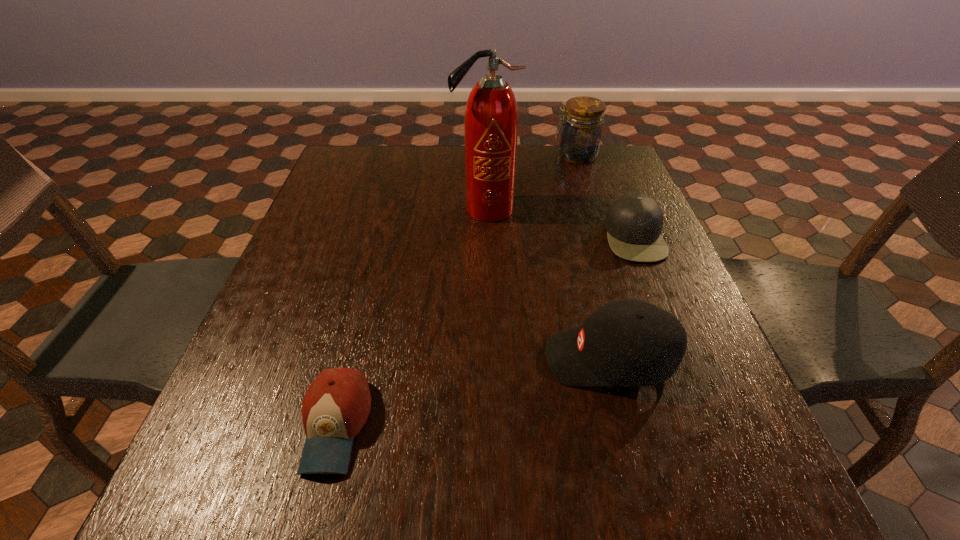
You are a GUI agent. You are given a task and a screenshot of the screen. Output one action in this format:
    pyautogui.click(x=<x>, y=<y>)
    Task: Click on the free region at the right edge
    
    Given the screenshot: What is the action you would take?
    pyautogui.click(x=683, y=315)

This screenshot has height=540, width=960. In order to click on vacant space at the far left corner of the desktop in this screenshot , I will do `click(360, 158)`.

This screenshot has height=540, width=960. In order to click on vacant area at the far right corner in this screenshot , I will do `click(626, 187)`.

Locate an element on the screen. The height and width of the screenshot is (540, 960). vacant space at the near right corner is located at coordinates (780, 526).

Locate an element on the screen. The height and width of the screenshot is (540, 960). vacant region between the fire extinguisher and the jar is located at coordinates (531, 183).

Find the location of a particular element. This screenshot has width=960, height=540. blank region between the right baseball cap and the fire extinguisher is located at coordinates (547, 284).

Where is `free point between the taller baseball cap and the shorter baseball cap`? The image size is (960, 540). free point between the taller baseball cap and the shorter baseball cap is located at coordinates (472, 392).

This screenshot has width=960, height=540. Find the location of `free point between the taller baseball cap and the shortest object`. free point between the taller baseball cap and the shortest object is located at coordinates (472, 392).

The width and height of the screenshot is (960, 540). I want to click on free spot between the left baseball cap and the fourth object from right to left, so click(411, 317).

Locate an element on the screen. The width and height of the screenshot is (960, 540). free spot between the shorter baseball cap and the third shortest object is located at coordinates (472, 392).